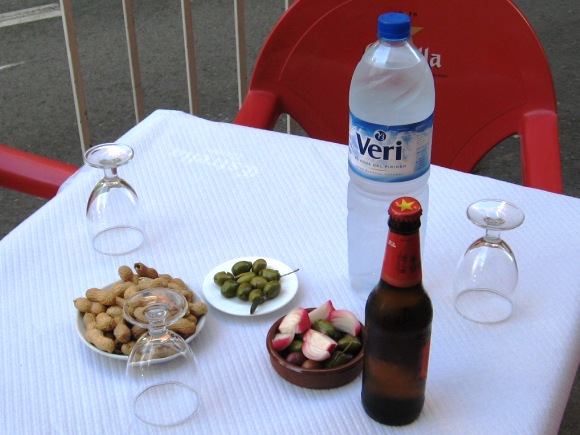
Locate an element on the screen. This screenshot has width=580, height=435. table is located at coordinates (456, 332).